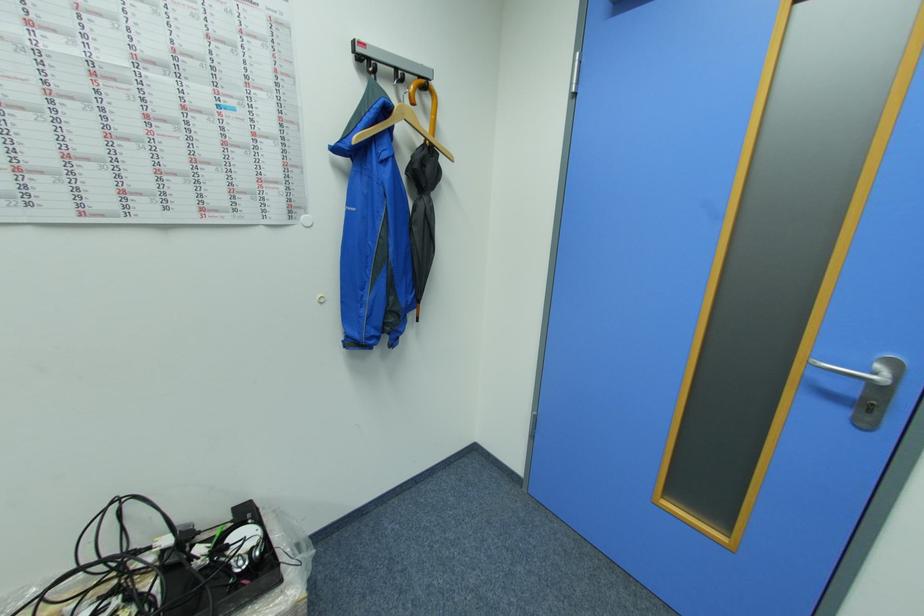
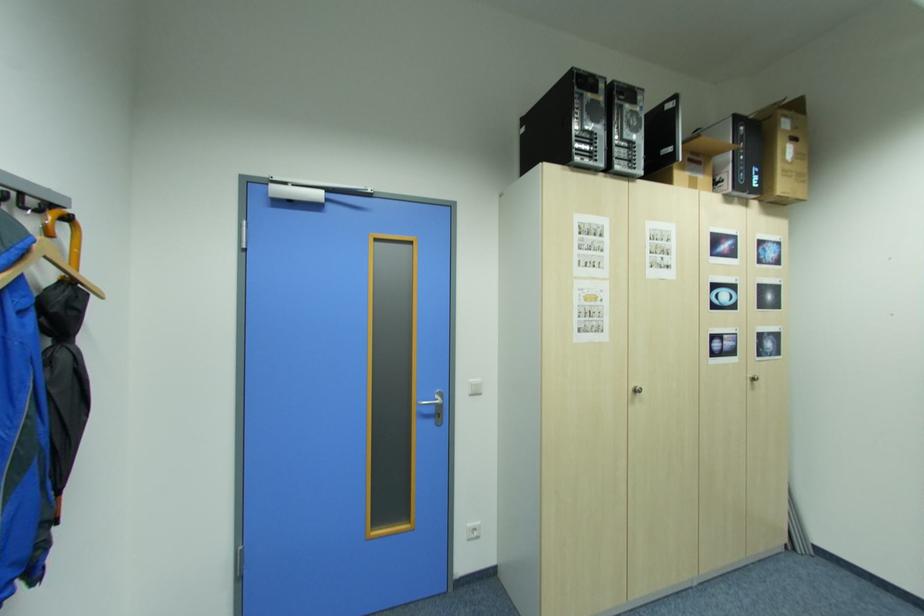
Find the pixel in the second image that matches pixel 394 111 in the first image.

(35, 251)